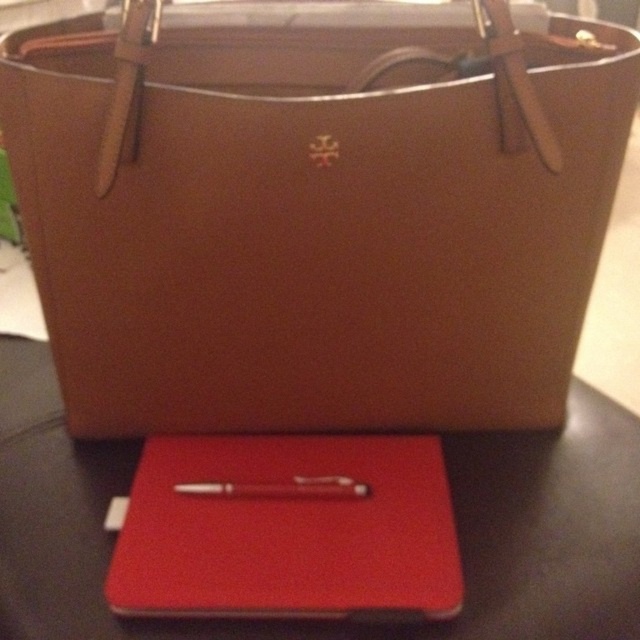
Who is more distant from viewer, [531,609] or [272,483]?

The point [272,483] is more distant.

Can you confirm if black leather table at center is positioned to the right of matte red pen at center?

Yes, black leather table at center is to the right of matte red pen at center.

Does point (76, 506) come in front of point (189, 492)?

No, it is not.

The height and width of the screenshot is (640, 640). What are the coordinates of `black leather table at center` in the screenshot? It's located at (342, 621).

Can you confirm if matte brown leather tote at center is thinner than black leather table at center?

Correct, matte brown leather tote at center's width is less than black leather table at center's.

Locate an element on the screen. The height and width of the screenshot is (640, 640). matte brown leather tote at center is located at coordinates coord(316,218).

Is point (540, 168) behind point (570, 394)?

No, it is in front of (570, 394).

You are a GUI agent. You are given a task and a screenshot of the screen. Output one action in this format:
    pyautogui.click(x=<x>, y=<y>)
    Task: Click on the matte brown leather tote at center
    
    Given the screenshot: What is the action you would take?
    pyautogui.click(x=316, y=218)

What do you see at coordinates (289, 529) in the screenshot? I see `rubberized red notebook at center` at bounding box center [289, 529].

Between rubberized red notebook at center and matte red pen at center, which one is positioned lower?

rubberized red notebook at center

Is point (212, 445) less distant than point (346, 483)?

No, (212, 445) is behind (346, 483).

Find the location of a particular element. rubberized red notebook at center is located at coordinates (289, 529).